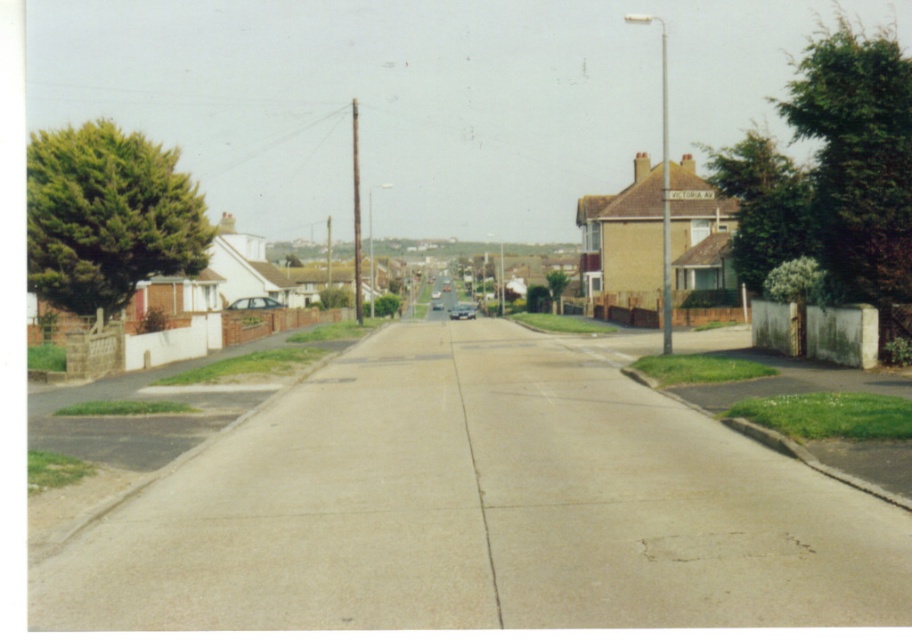
You are a delivery driver who needs to park your vehicle in a space that can accommodate both a matte silver car at center and a shiny silver car at center without overlapping. Given that the parking spot is only tall enough for vehicles up to the height of the taller car, which car should you park first to ensure both fit?

The shiny silver car at center is taller than the matte silver car at center. To ensure both fit in the parking spot, you should park the shiny silver car at center first, as it requires the full height of the space, allowing the shorter matte silver car at center to fit alongside without overlapping.

You are a pedestrian standing at the edge of the sidewalk on the left side of the street. You see both the matte silver car at center and the shiny silver car at center. Which car is nearer to you?

The matte silver car at center is closer to the viewer than the shiny silver car at center, so the matte silver car at center is nearer to you.

You are a pedestrian standing on the sidewalk near the large tree. You see two cars, the matte silver car at center and the shiny silver car at center. Which car is closer to the tree?

The matte silver car at center is above the shiny silver car at center, so the shiny silver car at center is closer to the tree.